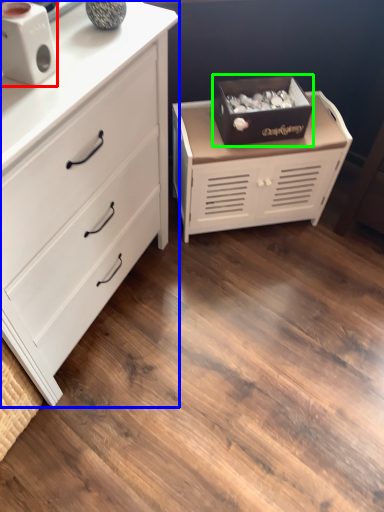
Question: Based on their relative distances, which object is nearer to speaker (highlighted by a red box)? Choose from chest of drawers (highlighted by a blue box) and storage box (highlighted by a green box).

Choices:
 (A) chest of drawers
 (B) storage box

Answer: (A)